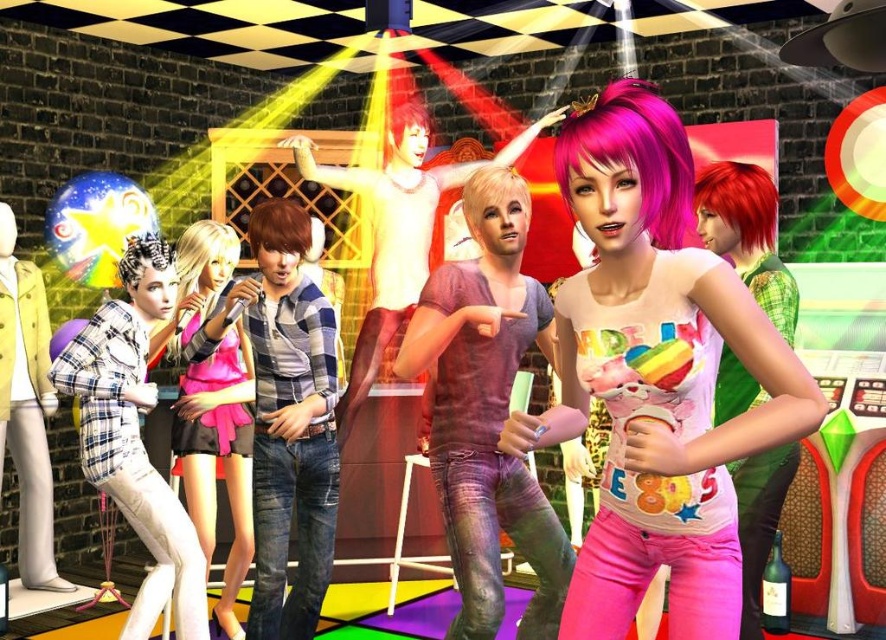
Question: Estimate the real-world distances between objects in this image. Which object is closer to the plaid fabric shirt at left?

Choices:
 (A) pastel rainbow t-shirt at center
 (B) purple shiny shirt at center
 (C) matte pink dress at center
 (D) matte purple wig at center

Answer: (C)

Question: Is purple shiny shirt at center thinner than plaid fabric shirt at left?

Choices:
 (A) yes
 (B) no

Answer: (A)

Question: Which point is farther from the camera taking this photo?

Choices:
 (A) (473, 618)
 (B) (189, 484)
 (C) (527, 420)

Answer: (B)

Question: Is the position of pastel rainbow t-shirt at center more distant than that of plaid fabric shirt at left?

Choices:
 (A) no
 (B) yes

Answer: (A)

Question: Among these points, which one is farthest from the camera?

Choices:
 (A) (484, 467)
 (B) (159, 252)
 (C) (522, 138)
 (D) (737, 614)

Answer: (C)

Question: Can you confirm if pastel rainbow t-shirt at center is positioned to the left of plaid fabric shirt at left?

Choices:
 (A) yes
 (B) no

Answer: (B)